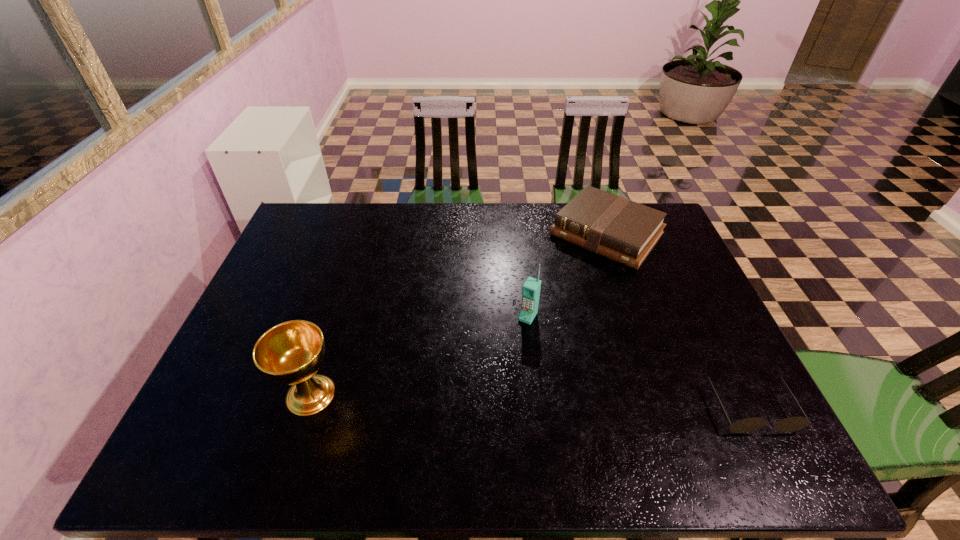
The image size is (960, 540). What are the coordinates of `vacant space located on the spine side of the farthest object` in the screenshot? It's located at (545, 304).

Where is `vacant space located 0.310m on the spine side of the farthest object`? This screenshot has width=960, height=540. vacant space located 0.310m on the spine side of the farthest object is located at coordinates tap(527, 326).

This screenshot has width=960, height=540. Find the location of `free point located 0.110m on the spine side of the farthest object`. free point located 0.110m on the spine side of the farthest object is located at coordinates (563, 284).

In order to click on object that is at the far edge in this screenshot , I will do `click(615, 227)`.

The height and width of the screenshot is (540, 960). Find the location of `chalice that is at the near edge`. chalice that is at the near edge is located at coordinates (290, 353).

Locate an element on the screen. The image size is (960, 540). sunglasses positioned at the near edge is located at coordinates (791, 424).

Identify the location of sunglasses at the right edge. Image resolution: width=960 pixels, height=540 pixels. click(x=791, y=424).

Where is `Bible situated at the right edge`? This screenshot has width=960, height=540. Bible situated at the right edge is located at coordinates (615, 227).

Locate an element on the screen. This screenshot has height=540, width=960. object present at the far right corner is located at coordinates (615, 227).

You are a GUI agent. You are given a task and a screenshot of the screen. Output one action in this format:
    pyautogui.click(x=<x>, y=<y>)
    Task: Click on the object located at the near right corner
    Image resolution: width=960 pixels, height=540 pixels.
    Given the screenshot: What is the action you would take?
    pyautogui.click(x=791, y=424)